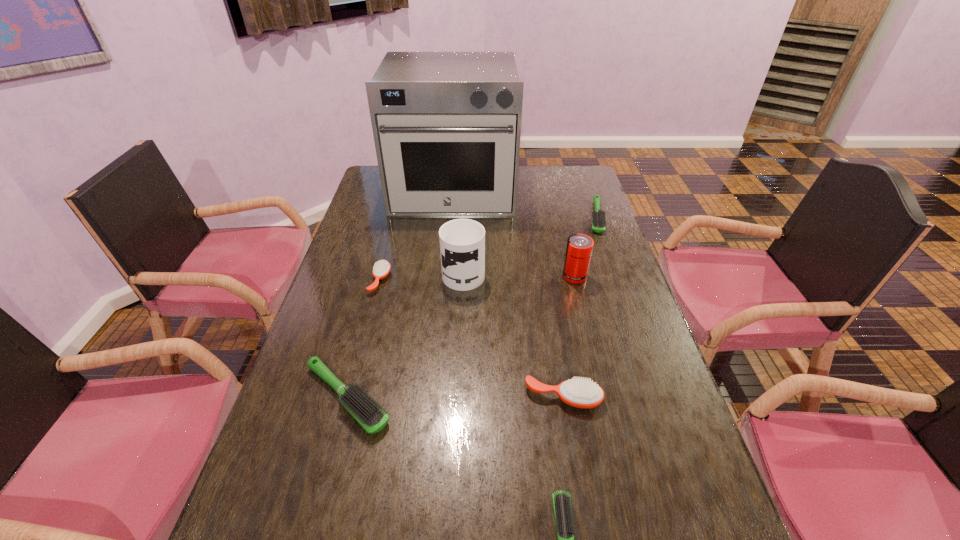
At what (x,y) coordinates should I click in order to perform the action: click on the farther orange hairbrush. Please return your answer as a coordinate pair (x, y). This screenshot has width=960, height=540. Looking at the image, I should click on (381, 269).

Locate an element on the screen. This screenshot has height=540, width=960. the fourth nearest hairbrush is located at coordinates (381, 269).

The height and width of the screenshot is (540, 960). I want to click on vacant space located 0.230m on the front panel of the toaster oven, so click(x=447, y=260).

This screenshot has height=540, width=960. I want to click on vacant space located 0.090m on the handle side of the white mug, so click(x=465, y=238).

Locate an element on the screen. The image size is (960, 540). vacant space located on the handle side of the white mug is located at coordinates (465, 245).

Where is `free space located on the handle side of the white mug`? This screenshot has height=540, width=960. free space located on the handle side of the white mug is located at coordinates (466, 233).

I want to click on free space located on the right of the can, so click(603, 276).

Find the location of `free space located on the right of the nearer orange hairbrush`. free space located on the right of the nearer orange hairbrush is located at coordinates (661, 397).

In order to click on vacant space located on the right of the leftmost light hairbrush in this screenshot , I will do `click(549, 397)`.

The height and width of the screenshot is (540, 960). In order to click on vacant space located on the front of the second biggest light hairbrush in this screenshot , I will do `click(626, 300)`.